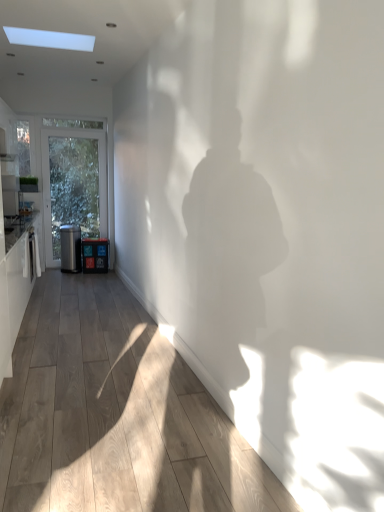
Question: Is white glossy cabinetry at left to the right of satin black trash can at left, which is the second appliance in right-to-left order, from the viewer's perspective?

Choices:
 (A) yes
 (B) no

Answer: (B)

Question: Is white glossy cabinetry at left facing away from satin black trash can at left, which is the second appliance in right-to-left order?

Choices:
 (A) yes
 (B) no

Answer: (B)

Question: Can you confirm if white glossy cabinetry at left is taller than satin black trash can at left, the first appliance viewed from the left?

Choices:
 (A) no
 (B) yes

Answer: (B)

Question: From the image's perspective, is white glossy cabinetry at left located beneath satin black trash can at left, the first appliance viewed from the left?

Choices:
 (A) yes
 (B) no

Answer: (A)

Question: Is white glossy cabinetry at left touching satin black trash can at left, the first appliance viewed from the left?

Choices:
 (A) yes
 (B) no

Answer: (B)

Question: Does white glossy cabinetry at left come behind satin black trash can at left, the first appliance viewed from the left?

Choices:
 (A) yes
 (B) no

Answer: (B)

Question: Can you confirm if matte black trash can at left, positioned as the 2th appliance in left-to-right order, is positioned to the right of satin black trash can at left, the first appliance viewed from the left?

Choices:
 (A) yes
 (B) no

Answer: (A)

Question: Does matte black trash can at left, which ranks as the 1th appliance in right-to-left order, have a greater width compared to satin black trash can at left, which is the second appliance in right-to-left order?

Choices:
 (A) yes
 (B) no

Answer: (B)

Question: From the image's perspective, does matte black trash can at left, which ranks as the 1th appliance in right-to-left order, appear lower than satin black trash can at left, the first appliance viewed from the left?

Choices:
 (A) no
 (B) yes

Answer: (B)

Question: Is matte black trash can at left, positioned as the 2th appliance in left-to-right order, smaller than satin black trash can at left, the first appliance viewed from the left?

Choices:
 (A) yes
 (B) no

Answer: (A)

Question: Does matte black trash can at left, which ranks as the 1th appliance in right-to-left order, touch satin black trash can at left, the first appliance viewed from the left?

Choices:
 (A) no
 (B) yes

Answer: (A)

Question: Considering the relative sizes of matte black trash can at left, which ranks as the 1th appliance in right-to-left order, and satin black trash can at left, the first appliance viewed from the left, in the image provided, is matte black trash can at left, which ranks as the 1th appliance in right-to-left order, bigger than satin black trash can at left, the first appliance viewed from the left,?

Choices:
 (A) no
 (B) yes

Answer: (A)

Question: From the image's perspective, does wooden floor at center appear lower than satin black trash can at left, which is the second appliance in right-to-left order?

Choices:
 (A) yes
 (B) no

Answer: (A)